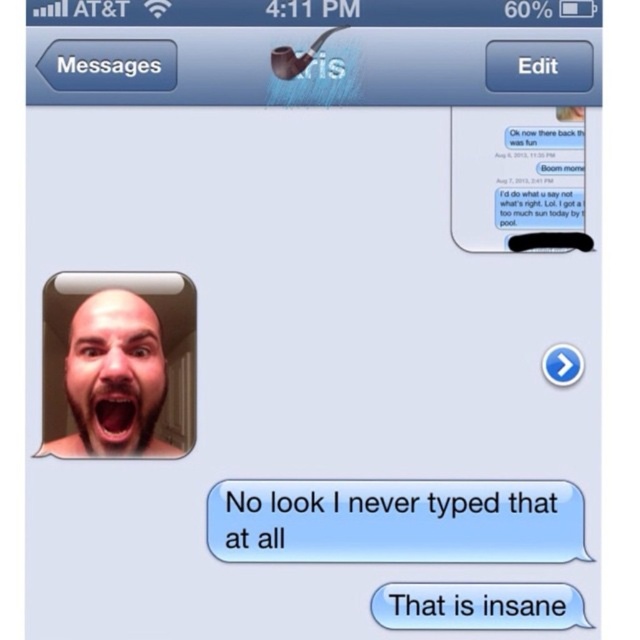
Is point (376, 529) more distant than point (438, 605)?

Yes, point (376, 529) is behind point (438, 605).

Which is behind, point (524, 536) or point (417, 614)?

The point (524, 536) is more distant.

Where is `white paper text message at center`? white paper text message at center is located at coordinates (394, 522).

Which is more to the left, white paper text message at center or bald head at upper left?

bald head at upper left is more to the left.

Can you confirm if white paper text message at center is taller than bald head at upper left?

No.

Identify the location of white paper text message at center. click(x=394, y=522).

Where is `bald head at upper left`? The image size is (640, 640). bald head at upper left is located at coordinates (113, 378).

This screenshot has height=640, width=640. Find the location of `bald head at upper left`. bald head at upper left is located at coordinates (113, 378).

You are a GUI agent. You are given a task and a screenshot of the screen. Output one action in this format:
    pyautogui.click(x=<x>, y=<y>)
    Task: Click on the bald head at upper left
    The width and height of the screenshot is (640, 640).
    Given the screenshot: What is the action you would take?
    pyautogui.click(x=113, y=378)